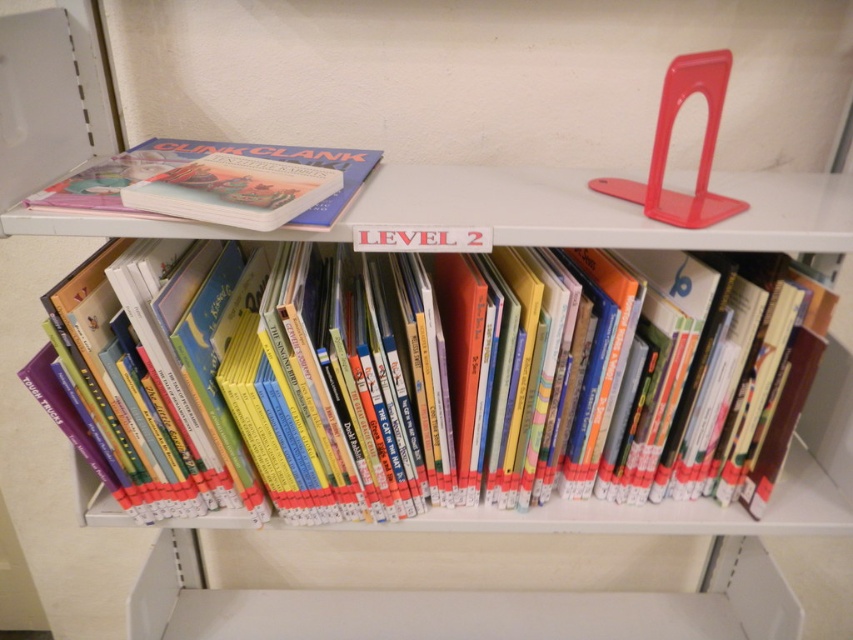
Question: Does hardcover books at center appear on the right side of matte hardcover book at upper left?

Choices:
 (A) no
 (B) yes

Answer: (B)

Question: Which object is farther from the camera taking this photo?

Choices:
 (A) matte hardcover book at upper left
 (B) hardcover books at center

Answer: (B)

Question: Can you confirm if hardcover books at center is positioned to the right of matte hardcover book at upper left?

Choices:
 (A) yes
 (B) no

Answer: (A)

Question: Does hardcover books at center appear under matte hardcover book at upper left?

Choices:
 (A) no
 (B) yes

Answer: (B)

Question: Which point is closer to the camera?

Choices:
 (A) (370, 161)
 (B) (254, 296)

Answer: (A)